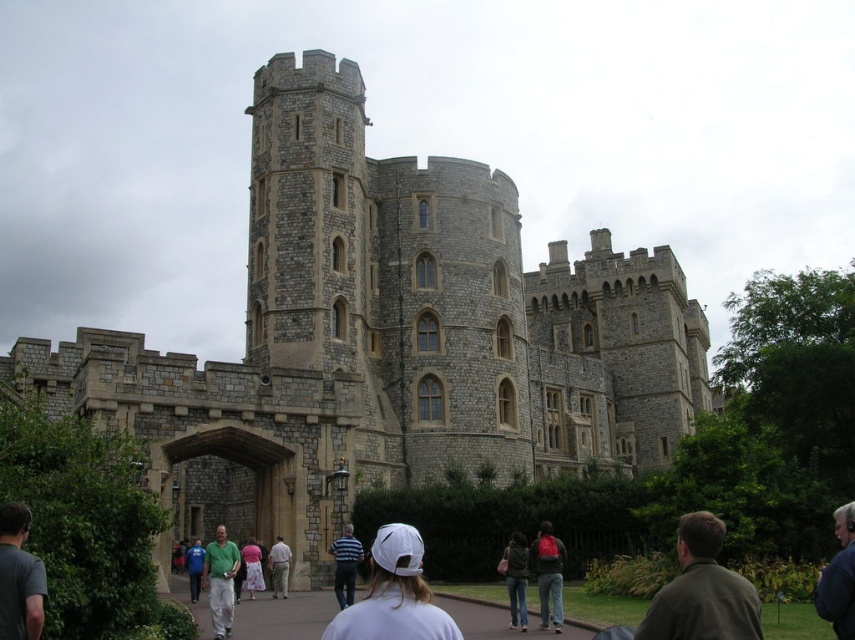
Who is positioned more to the right, dark blue jeans at lower right or dark green jacket at center?

Positioned to the right is dark blue jeans at lower right.

Can you confirm if dark blue jeans at lower right is taller than dark green jacket at center?

Correct, dark blue jeans at lower right is much taller as dark green jacket at center.

What do you see at coordinates (547, 576) in the screenshot? This screenshot has height=640, width=855. I see `dark blue jeans at lower right` at bounding box center [547, 576].

The height and width of the screenshot is (640, 855). Identify the location of dark blue jeans at lower right. (547, 576).

Is point (210, 612) farther from viewer compared to point (251, 570)?

That is False.

Is green matte shirt at lower center wider than pink fabric dress at center?

Yes.

The width and height of the screenshot is (855, 640). I want to click on green matte shirt at lower center, so click(220, 580).

Based on the photo, is white matte baseball cap at center smaller than striped cotton shirt at center?

No.

Does point (346, 621) come closer to viewer compared to point (335, 563)?

Yes, point (346, 621) is closer to viewer.

The height and width of the screenshot is (640, 855). Identify the location of white matte baseball cap at center. (394, 595).

At what (x,y) coordinates should I click in order to perform the action: click on white matte baseball cap at center. Please return your answer as a coordinate pair (x, y). The height and width of the screenshot is (640, 855). Looking at the image, I should click on pos(394,595).